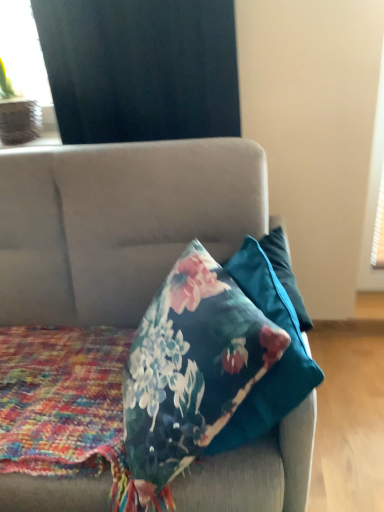
Locate an element on the screen. velvet floral pillow at center is located at coordinates (118, 223).

Where is `black matte curtain at upper left`? This screenshot has height=512, width=384. black matte curtain at upper left is located at coordinates (140, 68).

The height and width of the screenshot is (512, 384). Describe the element at coordinates (140, 68) in the screenshot. I see `black matte curtain at upper left` at that location.

This screenshot has width=384, height=512. I want to click on floral-patterned fabric at center, so click(x=65, y=405).

In order to click on velvet floral pillow at center in this screenshot , I will do `click(118, 223)`.

Is floral-patterned fabric at center completely or partially inside velvet floral pillow at center?

Yes.

You are a GUI agent. You are given a task and a screenshot of the screen. Output one action in this format:
    pyautogui.click(x=<x>, y=<y>)
    Task: Click on the blanket directly beneath the velvet floral pillow at center (from a real-world perspective)
    
    Given the screenshot: What is the action you would take?
    pyautogui.click(x=65, y=405)

Which of these two, velvet floral pillow at center or floral-patterned fabric at center, is smaller?

Smaller between the two is floral-patterned fabric at center.

Which object is more forward, velvet floral pillow at center or floral-patterned fabric at center?

Positioned in front is velvet floral pillow at center.

Is black matte curtain at upper left positioned far away from floral-patterned fabric at center?

They are positioned close to each other.

Does black matte curtain at upper left have a smaller size compared to floral-patterned fabric at center?

Indeed, black matte curtain at upper left has a smaller size compared to floral-patterned fabric at center.

Does black matte curtain at upper left have a lesser height compared to floral-patterned fabric at center?

No, black matte curtain at upper left is not shorter than floral-patterned fabric at center.

The width and height of the screenshot is (384, 512). I want to click on blanket in front of the black matte curtain at upper left, so click(x=65, y=405).

From a real-world perspective, which is physically below, black matte curtain at upper left or matte black curtain at upper left?

black matte curtain at upper left.

Is black matte curtain at upper left at the left side of matte black curtain at upper left?

Incorrect, black matte curtain at upper left is not on the left side of matte black curtain at upper left.

Between black matte curtain at upper left and matte black curtain at upper left, which one has larger width?

matte black curtain at upper left.

In terms of height, does black matte curtain at upper left look taller or shorter compared to matte black curtain at upper left?

Considering their sizes, black matte curtain at upper left has less height than matte black curtain at upper left.

Is matte black curtain at upper left touching velvet floral pillow at center?

matte black curtain at upper left and velvet floral pillow at center are not in contact.

Is matte black curtain at upper left to the right of velvet floral pillow at center from the viewer's perspective?

No, matte black curtain at upper left is not to the right of velvet floral pillow at center.

Who is smaller, matte black curtain at upper left or velvet floral pillow at center?

Smaller between the two is matte black curtain at upper left.

Is matte black curtain at upper left further to the viewer compared to velvet floral pillow at center?

That is True.

From the picture: Is floral-patterned fabric at center facing towards floral fabric pillow at center?

No, floral-patterned fabric at center is not oriented towards floral fabric pillow at center.

Can we say floral-patterned fabric at center lies outside floral fabric pillow at center?

floral-patterned fabric at center is positioned outside floral fabric pillow at center.

Which object is wider, floral-patterned fabric at center or floral fabric pillow at center?

With larger width is floral-patterned fabric at center.

In the scene shown: From a real-world perspective, relative to floral fabric pillow at center, is matte black curtain at upper left vertically above or below?

In terms of real-world spatial position, matte black curtain at upper left is above floral fabric pillow at center.

From the image's perspective, which is above, matte black curtain at upper left or floral fabric pillow at center?

matte black curtain at upper left, from the image's perspective.

Is there a large distance between matte black curtain at upper left and floral fabric pillow at center?

Yes, matte black curtain at upper left and floral fabric pillow at center are located far from each other.

Is floral-patterned fabric at center completely or partially outside of black matte curtain at upper left?

Yes, floral-patterned fabric at center is outside of black matte curtain at upper left.

Considering the positions of objects floral-patterned fabric at center and black matte curtain at upper left in the image provided, who is behind, floral-patterned fabric at center or black matte curtain at upper left?

black matte curtain at upper left is more distant.

Based on the photo, how much distance is there between floral-patterned fabric at center and black matte curtain at upper left?

They are 33.98 inches apart.

Is floral-patterned fabric at center to the right of black matte curtain at upper left from the viewer's perspective?

In fact, floral-patterned fabric at center is to the left of black matte curtain at upper left.

The width and height of the screenshot is (384, 512). In order to click on studio couch that appears in front of the floral-patterned fabric at center in this screenshot , I will do `click(118, 223)`.

Where is `curtain that is on the right side of floral-patterned fabric at center`? curtain that is on the right side of floral-patterned fabric at center is located at coordinates (140, 68).

In the scene shown: Estimate the real-world distances between objects in this image. Which object is further from matte black curtain at upper left, velvet floral pillow at center or floral fabric pillow at center?

floral fabric pillow at center is positioned further to the anchor matte black curtain at upper left.

Considering their positions, is matte black curtain at upper left positioned closer to black matte curtain at upper left than velvet floral pillow at center?

velvet floral pillow at center lies closer to black matte curtain at upper left than the other object.

Based on the photo, which object lies further to the anchor point velvet floral pillow at center, floral fabric pillow at center or matte black curtain at upper left?

matte black curtain at upper left is further to velvet floral pillow at center.

Looking at the image, which one is located further to floral fabric pillow at center, floral-patterned fabric at center or black matte curtain at upper left?

black matte curtain at upper left.

Based on their spatial positions, is matte black curtain at upper left or velvet floral pillow at center further from floral fabric pillow at center?

The object further to floral fabric pillow at center is matte black curtain at upper left.

Considering their positions, is floral fabric pillow at center positioned further to velvet floral pillow at center than floral-patterned fabric at center?

floral fabric pillow at center is further to velvet floral pillow at center.

When comparing their distances from floral-patterned fabric at center, does matte black curtain at upper left or velvet floral pillow at center seem closer?

The object closer to floral-patterned fabric at center is velvet floral pillow at center.

Considering their positions, is black matte curtain at upper left positioned further to matte black curtain at upper left than velvet floral pillow at center?

velvet floral pillow at center.

Where is `pillow that lies between matte black curtain at upper left and velvet floral pillow at center from top to bottom`? Image resolution: width=384 pixels, height=512 pixels. pillow that lies between matte black curtain at upper left and velvet floral pillow at center from top to bottom is located at coordinates (284, 353).

Identify the location of curtain situated between matte black curtain at upper left and floral fabric pillow at center from left to right. (140, 68).

Find the location of a particular element. pillow between black matte curtain at upper left and velvet floral pillow at center from top to bottom is located at coordinates (284, 353).

At what (x,y) coordinates should I click in order to perform the action: click on studio couch situated between floral-patterned fabric at center and floral fabric pillow at center from left to right. Please return your answer as a coordinate pair (x, y). The image size is (384, 512). Looking at the image, I should click on (118, 223).